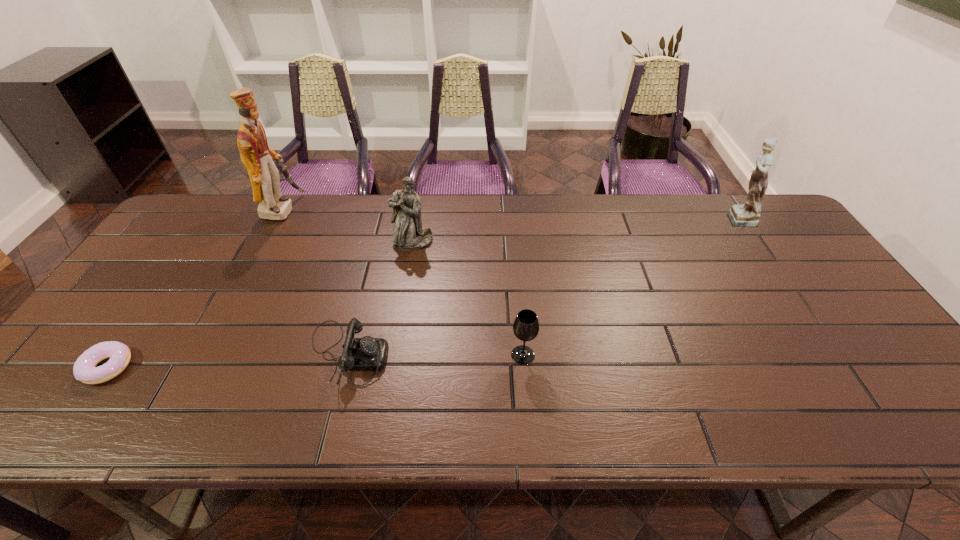
Locate an element on the screen. The height and width of the screenshot is (540, 960). vacant area between the nearer figurine and the leftmost object is located at coordinates (260, 305).

Locate an element on the screen. This screenshot has height=540, width=960. free space between the second shortest object and the third farthest object is located at coordinates (380, 298).

Image resolution: width=960 pixels, height=540 pixels. I want to click on unoccupied area between the fifth tallest object and the rightmost object, so click(541, 286).

Where is `free space that is in between the leftmost object and the fourth nearest object`? Image resolution: width=960 pixels, height=540 pixels. free space that is in between the leftmost object and the fourth nearest object is located at coordinates tap(260, 305).

Where is `vacant point located between the nutcracker and the left figurine`? vacant point located between the nutcracker and the left figurine is located at coordinates (348, 226).

The height and width of the screenshot is (540, 960). I want to click on blank region between the second shortest object and the shortest object, so click(x=228, y=361).

You are a GUI agent. You are given a task and a screenshot of the screen. Output one action in this format:
    pyautogui.click(x=<x>, y=<y>)
    Task: Click on the vacant region between the shorter figurine and the shortest object
    Image resolution: width=960 pixels, height=540 pixels.
    Given the screenshot: What is the action you would take?
    pyautogui.click(x=260, y=305)

At what (x,y) coordinates should I click in order to perform the action: click on empty space that is in between the leftmost object and the third shortest object. Please return your answer as a coordinate pair (x, y). This screenshot has width=960, height=540. Looking at the image, I should click on (315, 361).

Locate an element on the screen. Image resolution: width=960 pixels, height=540 pixels. empty location between the doughnut and the wineglass is located at coordinates (315, 361).

Where is `the fifth closest object to the third shortest object`? The image size is (960, 540). the fifth closest object to the third shortest object is located at coordinates (84, 369).